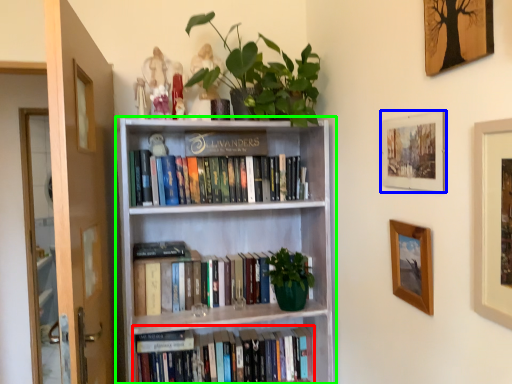
Question: Which object is the closest to the book (highlighted by a red box)? Choose among these: picture frame (highlighted by a blue box) or bookcase (highlighted by a green box).

Choices:
 (A) picture frame
 (B) bookcase

Answer: (B)